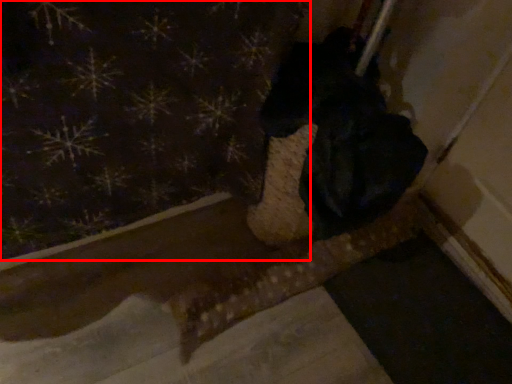
Question: In this image, where is curtain (annotated by the red box) located relative to animal?

Choices:
 (A) right
 (B) left

Answer: (B)